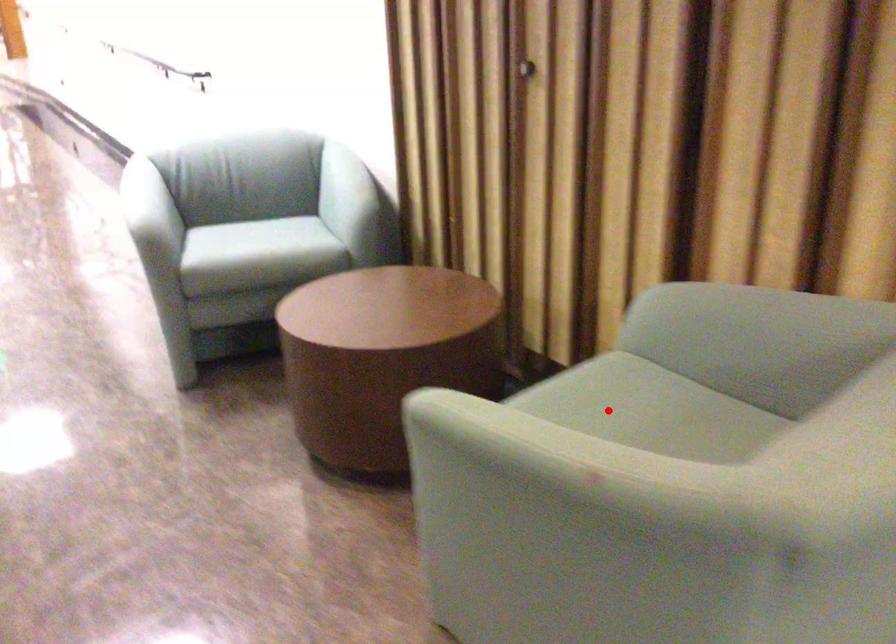
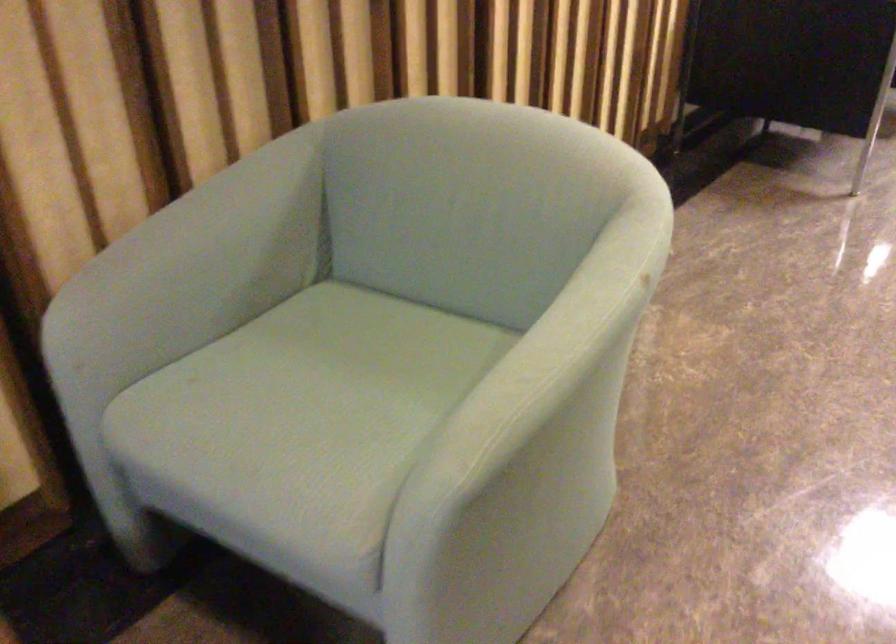
Question: I am providing you with two images of the same scene from different viewpoints. In image1, a red point is highlighted. Considering the same 3D point in image2, which of the following is correct?

Choices:
 (A) It is closer
 (B) It is farther

Answer: (A)